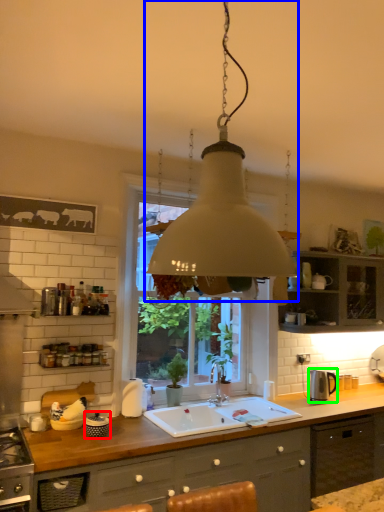
Question: Which object is positioned farthest from appliance (highlighted by a red box)? Select from lamp (highlighted by a blue box) and appliance (highlighted by a green box).

Choices:
 (A) lamp
 (B) appliance

Answer: (B)